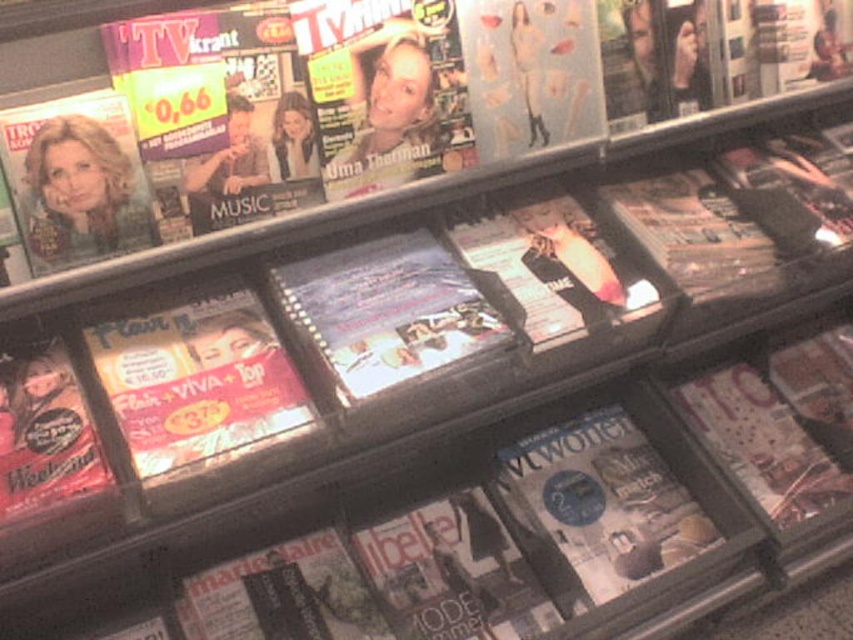
Does matte blue magazine at center come in front of matte glossy magazine at center?

Yes, matte blue magazine at center is closer to the viewer.

Is matte blue magazine at center below matte glossy magazine at center?

Correct, matte blue magazine at center is located below matte glossy magazine at center.

Who is more distant from viewer, (469, 342) or (718, 109)?

Point (718, 109)

Identify the location of matte blue magazine at center. The height and width of the screenshot is (640, 853). (387, 310).

Is point (302, 406) closer to camera compared to point (535, 532)?

That is True.

I want to click on matte plastic magazine at center left, so click(196, 381).

Does matte plastic magazine at center left lie behind matte glossy magazine at center?

No, matte plastic magazine at center left is closer to the viewer.

Which is more to the left, matte plastic magazine at center left or matte glossy magazine at center?

matte plastic magazine at center left

This screenshot has width=853, height=640. I want to click on matte plastic magazine at center left, so click(x=196, y=381).